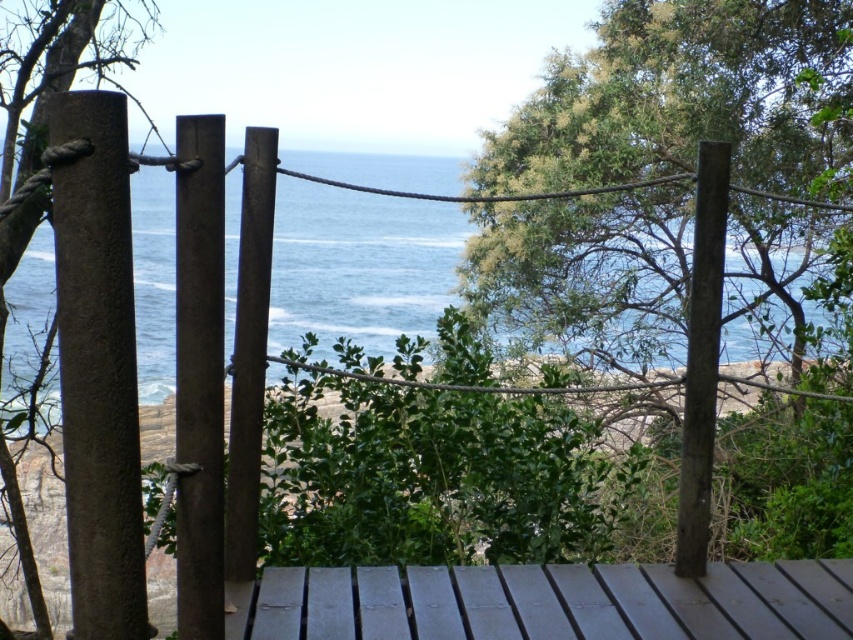
Who is more forward, (781, 84) or (33, 563)?

Positioned in front is point (33, 563).

Does point (640, 305) come behind point (12, 225)?

Yes, point (640, 305) is behind point (12, 225).

The height and width of the screenshot is (640, 853). Describe the element at coordinates (666, 192) in the screenshot. I see `green leafy tree at center` at that location.

This screenshot has width=853, height=640. What are the coordinates of `green leafy tree at center` in the screenshot? It's located at (666, 192).

Can you confirm if green leafy tree at center is positioned to the left of smooth dark wood deck at center?

In fact, green leafy tree at center is to the right of smooth dark wood deck at center.

The width and height of the screenshot is (853, 640). Describe the element at coordinates (666, 192) in the screenshot. I see `green leafy tree at center` at that location.

In order to click on green leafy tree at center in this screenshot , I will do pos(666,192).

What do you see at coordinates (556, 602) in the screenshot? I see `smooth dark wood deck at center` at bounding box center [556, 602].

Is point (791, 573) positioned behind point (41, 362)?

No, (791, 573) is closer to viewer.

Is point (345, 618) positioned after point (55, 10)?

That is False.

The height and width of the screenshot is (640, 853). Identify the location of smooth dark wood deck at center. (556, 602).